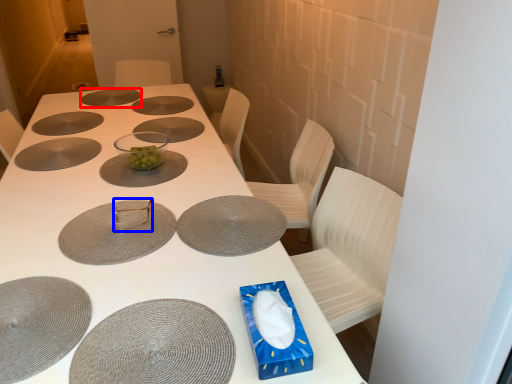
Question: Which object is further to the camera taking this photo, glass plate (highlighted by a red box) or tableware (highlighted by a blue box)?

Choices:
 (A) glass plate
 (B) tableware

Answer: (A)